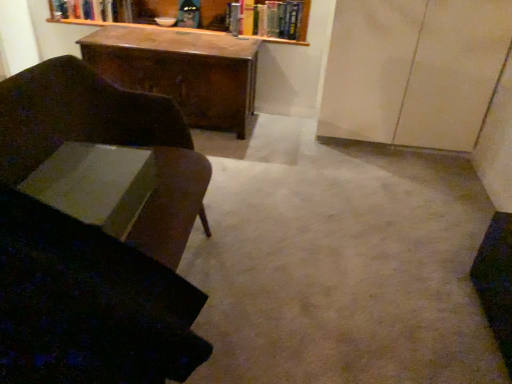
Question: Is the depth of white paper at lower left, the 3th book viewed from the top, less than that of wooden desk at center?

Choices:
 (A) yes
 (B) no

Answer: (A)

Question: From a real-world perspective, does white paper at lower left, positioned as the 3th book in back-to-front order, sit lower than wooden desk at center?

Choices:
 (A) no
 (B) yes

Answer: (A)

Question: Is the depth of white paper at lower left, the 3th book viewed from the top, greater than that of wooden desk at center?

Choices:
 (A) yes
 (B) no

Answer: (B)

Question: Considering the relative positions of white paper at lower left, the 1th book positioned from the bottom, and wooden desk at center in the image provided, is white paper at lower left, the 1th book positioned from the bottom, to the left of wooden desk at center from the viewer's perspective?

Choices:
 (A) no
 (B) yes

Answer: (A)

Question: From a real-world perspective, is white paper at lower left, the 1th book positioned from the front, on top of wooden desk at center?

Choices:
 (A) yes
 (B) no

Answer: (A)

Question: Is matte beige cabinet at right bigger or smaller than wooden desk at center?

Choices:
 (A) small
 (B) big

Answer: (B)

Question: From a real-world perspective, is matte beige cabinet at right physically located above or below wooden desk at center?

Choices:
 (A) above
 (B) below

Answer: (A)

Question: Relative to wooden desk at center, is matte beige cabinet at right in front or behind?

Choices:
 (A) behind
 (B) front

Answer: (B)

Question: Looking at their shapes, would you say matte beige cabinet at right is wider or thinner than wooden desk at center?

Choices:
 (A) thin
 (B) wide

Answer: (A)

Question: Is point (340, 4) positioned closer to the camera than point (74, 213)?

Choices:
 (A) farther
 (B) closer

Answer: (A)

Question: From a real-world perspective, is matte beige cabinet at right above or below white paper at lower left, positioned as the 3th book in back-to-front order?

Choices:
 (A) above
 (B) below

Answer: (B)

Question: From the image's perspective, is matte beige cabinet at right positioned above or below white paper at lower left, the 1th book positioned from the bottom?

Choices:
 (A) above
 (B) below

Answer: (A)

Question: Is matte beige cabinet at right situated inside white paper at lower left, the 3th book viewed from the top, or outside?

Choices:
 (A) inside
 (B) outside

Answer: (B)

Question: Is white paper at lower left, the 1th book positioned from the front, wider or thinner than wooden desk at center?

Choices:
 (A) wide
 (B) thin

Answer: (B)

Question: In terms of height, does white paper at lower left, which is counted as the second book, starting from the left, look taller or shorter compared to wooden desk at center?

Choices:
 (A) short
 (B) tall

Answer: (A)